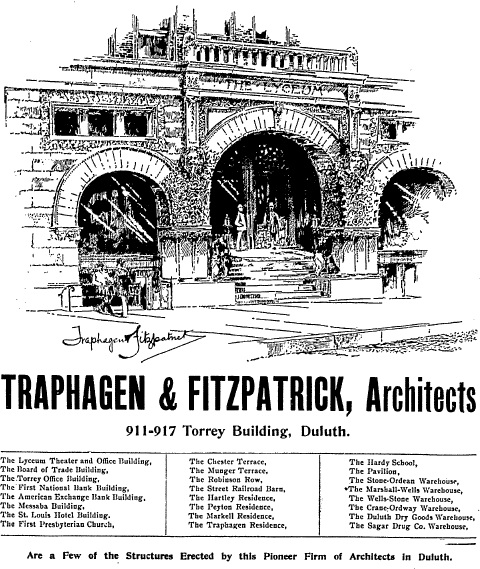
Where is `pillars`? The height and width of the screenshot is (569, 480). pillars is located at coordinates (180, 222).